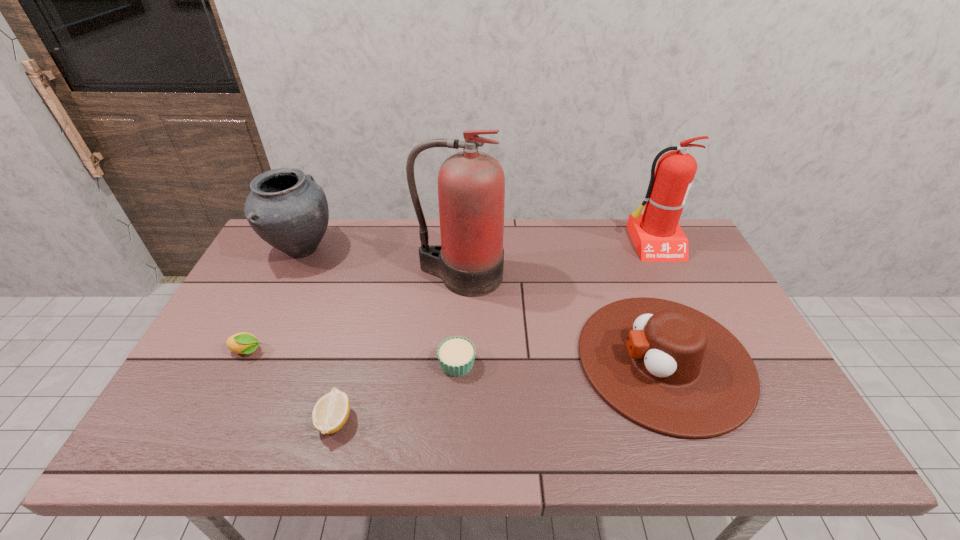
The width and height of the screenshot is (960, 540). I want to click on vacant region between the tallest object and the nearer lemon, so click(397, 348).

Locate an element on the screen. The height and width of the screenshot is (540, 960). unoccupied position between the urn and the right lemon is located at coordinates (319, 335).

Find the location of a particular element. The height and width of the screenshot is (540, 960). object that stands as the fourth closest to the nearer lemon is located at coordinates (286, 208).

Identify which object is located as the second nearest to the right lemon. Please provide its 2D coordinates. Your answer should be formatted as a tuple, i.e. [(x, y)], where the tuple contains the x and y coordinates of a point satisfying the conditions above.

[(242, 343)]

At what (x,y) coordinates should I click in order to perform the action: click on vacant space that satisfies the following two spatial constraints: 1. on the back side of the cupcake; 2. on the right side of the shorter lemon. Please return your answer as a coordinate pair (x, y). Looking at the image, I should click on (350, 363).

You are a GUI agent. You are given a task and a screenshot of the screen. Output one action in this format:
    pyautogui.click(x=<x>, y=<y>)
    Task: Click on the vacant area in the image that satisfies the following two spatial constraints: 1. on the front-facing side of the sixth shortest object; 2. with leaves positioned above the taller lemon
    
    Given the screenshot: What is the action you would take?
    pyautogui.click(x=704, y=352)